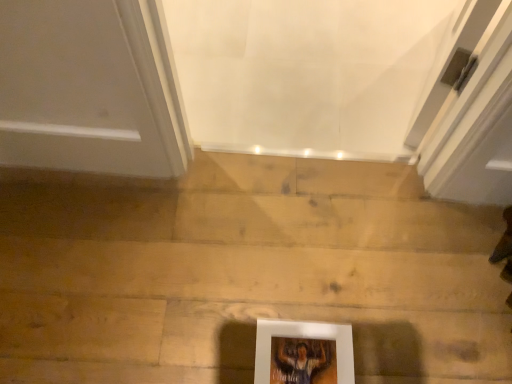
Find the location of `empty space that is ontop of white matte picture frame at lower center (from a real-world perspective)`. empty space that is ontop of white matte picture frame at lower center (from a real-world perspective) is located at coordinates (300, 360).